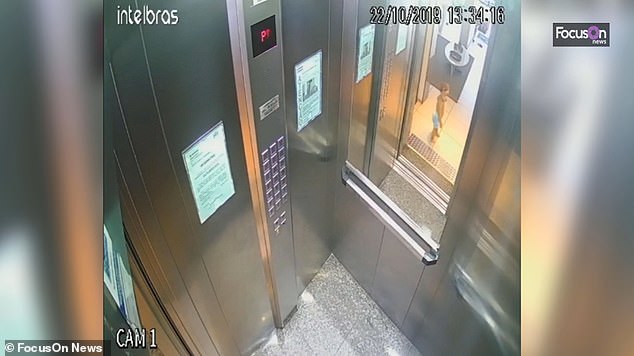
I want to click on rug, so click(x=451, y=81).